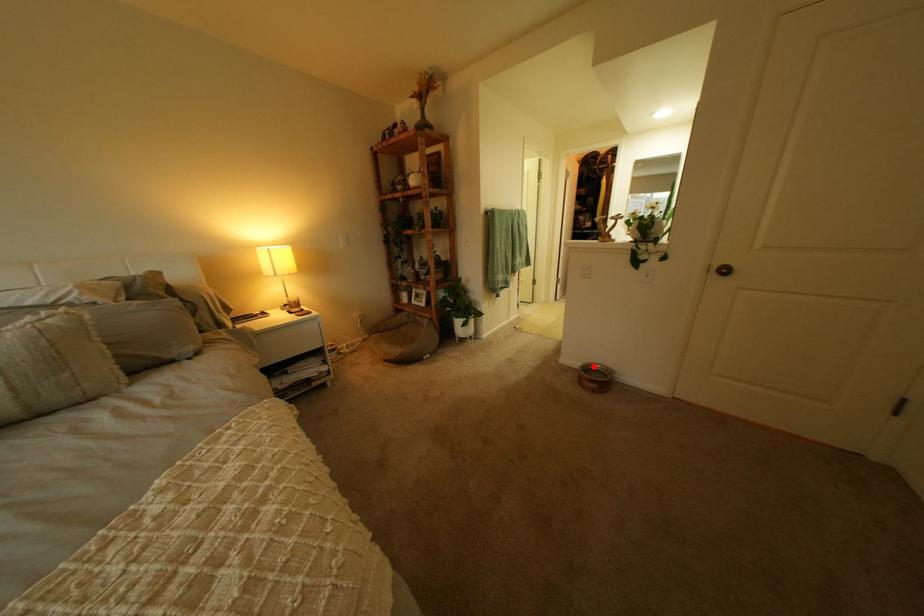
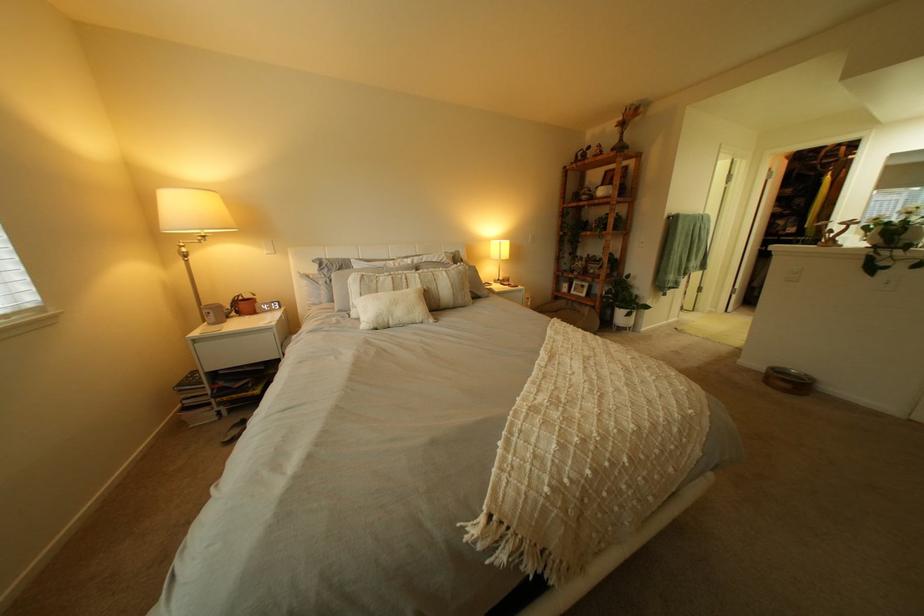
Locate, in the second image, the point that corresponds to the highlighted location in the first image.

(779, 369)